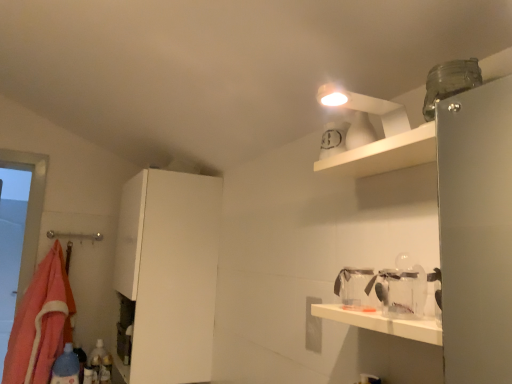
Question: Does blue plastic bottle at lower left lie in front of transparent plastic jar at lower right?

Choices:
 (A) yes
 (B) no

Answer: (B)

Question: Is blue plastic bottle at lower left in contact with transparent plastic jar at lower right?

Choices:
 (A) yes
 (B) no

Answer: (B)

Question: Is blue plastic bottle at lower left to the right of transparent plastic jar at lower right from the viewer's perspective?

Choices:
 (A) yes
 (B) no

Answer: (B)

Question: Is blue plastic bottle at lower left wider than transparent plastic jar at lower right?

Choices:
 (A) no
 (B) yes

Answer: (A)

Question: Is blue plastic bottle at lower left not inside transparent plastic jar at lower right?

Choices:
 (A) no
 (B) yes

Answer: (B)

Question: Is blue plastic bottle at lower left to the left of transparent plastic jar at lower right from the viewer's perspective?

Choices:
 (A) yes
 (B) no

Answer: (A)

Question: Is white matte cabinet at left shorter than transparent plastic jar at lower right?

Choices:
 (A) yes
 (B) no

Answer: (B)

Question: Can you confirm if white matte cabinet at left is smaller than transparent plastic jar at lower right?

Choices:
 (A) yes
 (B) no

Answer: (B)

Question: Is white matte cabinet at left looking in the opposite direction of transparent plastic jar at lower right?

Choices:
 (A) no
 (B) yes

Answer: (A)

Question: Does white matte cabinet at left appear on the left side of transparent plastic jar at lower right?

Choices:
 (A) yes
 (B) no

Answer: (A)

Question: Can you confirm if white matte cabinet at left is wider than transparent plastic jar at lower right?

Choices:
 (A) yes
 (B) no

Answer: (A)

Question: Does white matte cabinet at left come behind transparent plastic jar at lower right?

Choices:
 (A) yes
 (B) no

Answer: (A)

Question: Does white matte cabinet at left have a greater height compared to orange fleece blanket at left?

Choices:
 (A) yes
 (B) no

Answer: (A)